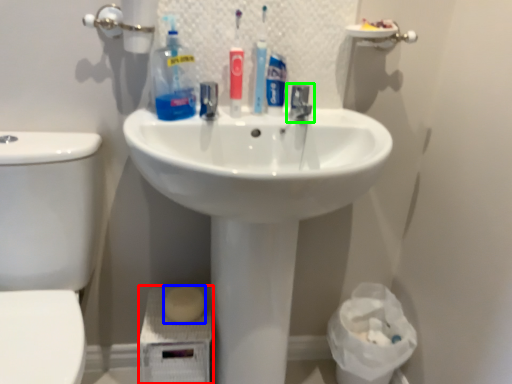
Question: Considering the real-world distances, which object is closest to porcelain (highlighted by a red box)? soap (highlighted by a blue box) or tap (highlighted by a green box).

Choices:
 (A) soap
 (B) tap

Answer: (A)